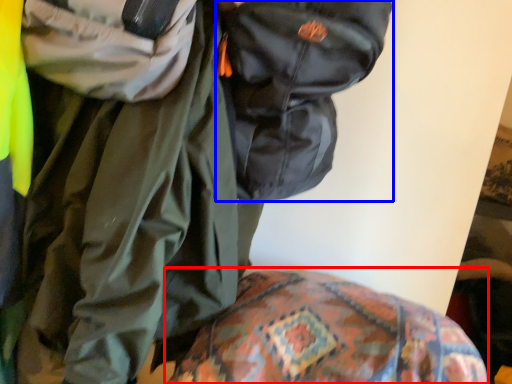
Question: Among these objects, which one is farthest to the camera, bedding (highlighted by a red box) or backpack (highlighted by a blue box)?

Choices:
 (A) bedding
 (B) backpack

Answer: (B)